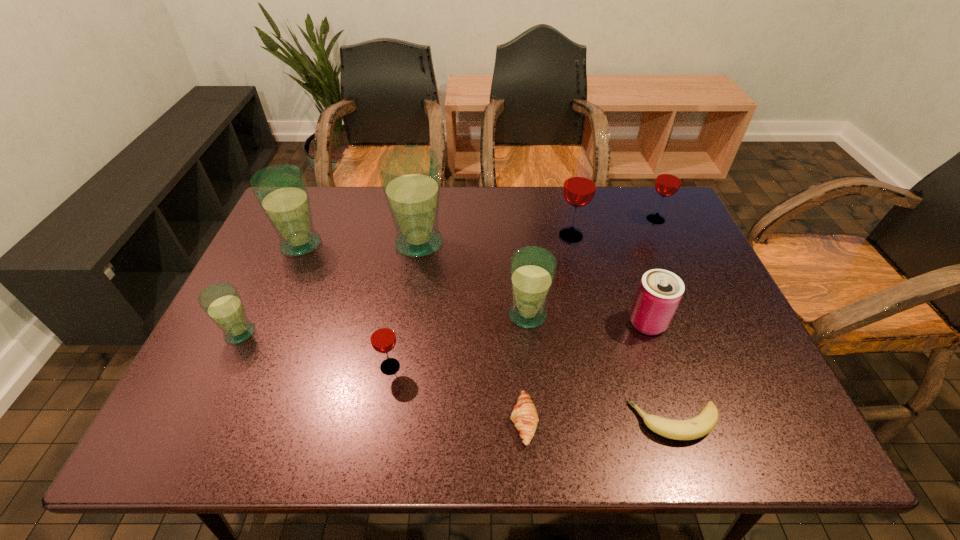
Find the location of a particular element. The image size is (960, 540). pastry that is at the near edge is located at coordinates (525, 417).

Where is `banana at the near edge`? The height and width of the screenshot is (540, 960). banana at the near edge is located at coordinates (699, 426).

At what (x,y) coordinates should I click in order to perform the action: click on glass that is positioned at the right edge. Please return your answer as a coordinate pair (x, y). The height and width of the screenshot is (540, 960). Looking at the image, I should click on pyautogui.click(x=668, y=181).

Identify the location of banana that is at the right edge. coord(699,426).

I want to click on object at the far left corner, so (281, 190).

The image size is (960, 540). Identify the location of object present at the far right corner. (668, 181).

Identify the location of object present at the near right corner. (699, 426).

Where is `free location at the far edge`? Image resolution: width=960 pixels, height=540 pixels. free location at the far edge is located at coordinates (616, 231).

Find the location of a particular element. Image resolution: width=960 pixels, height=540 pixels. free space at the near edge of the desktop is located at coordinates (582, 435).

This screenshot has width=960, height=540. I want to click on free space at the left edge of the desktop, so click(x=284, y=305).